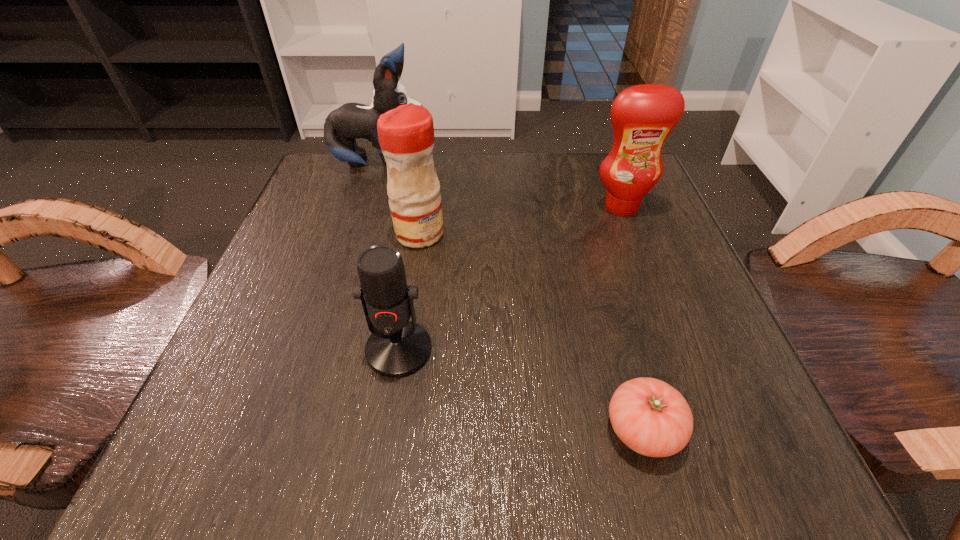
Locate an element on the screen. This screenshot has height=540, width=960. free point located 0.240m on the front of the left condiment is located at coordinates (400, 360).

Image resolution: width=960 pixels, height=540 pixels. I want to click on vacant space located 0.220m on the label side of the second farthest object, so click(x=658, y=300).

Find the location of a particular element. The width and height of the screenshot is (960, 540). vacant area situated 0.120m on the side of the second shortest object with the red ring is located at coordinates pyautogui.click(x=381, y=465).

This screenshot has width=960, height=540. Identify the location of vacant area located on the left of the tomato. (432, 429).

This screenshot has width=960, height=540. I want to click on puppy positioned at the far edge, so click(x=351, y=121).

At what (x,y) coordinates should I click in order to perform the action: click on condiment located at the far edge. Please return your answer as a coordinate pair (x, y). The image size is (960, 540). Looking at the image, I should click on (643, 116).

At what (x,y) coordinates should I click in order to perform the action: click on object at the near edge. Please return your answer as a coordinate pair (x, y). The height and width of the screenshot is (540, 960). Looking at the image, I should click on (652, 418).

Locate an element on the screen. The image size is (960, 540). object that is at the left edge is located at coordinates (351, 121).

Locate an element on the screen. condiment that is positioned at the right edge is located at coordinates (643, 116).

Find the location of a particular element. This screenshot has width=960, height=540. tomato present at the right edge is located at coordinates (652, 418).